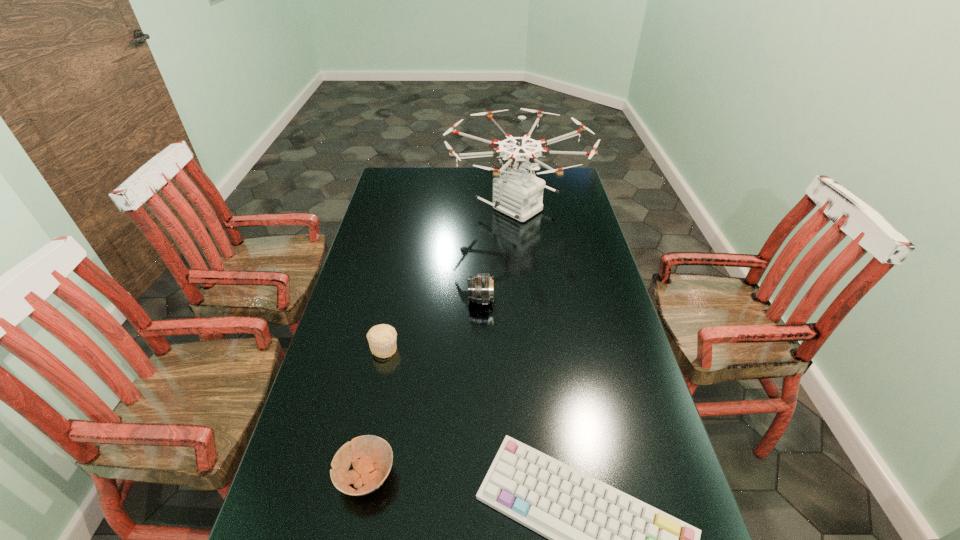
Locate an element on the screen. vacant space situated at the front element of the fourth nearest object is located at coordinates (344, 300).

The height and width of the screenshot is (540, 960). What are the coordinates of `vacant space situated 0.210m on the front of the third tallest object` in the screenshot? It's located at (368, 429).

Image resolution: width=960 pixels, height=540 pixels. Identify the location of vacant space situated 0.270m on the right of the bowl. (516, 476).

Identify the location of object situated at the far edge. (519, 194).

Where is `muffin situated at the left edge`? muffin situated at the left edge is located at coordinates (382, 338).

What are the coordinates of `bowl present at the left edge` in the screenshot? It's located at (371, 470).

The width and height of the screenshot is (960, 540). Find the location of `object at the right edge`. object at the right edge is located at coordinates (519, 194).

At what (x,y) coordinates should I click in order to perform the action: click on object located in the far right corner section of the desktop. Please return your answer as a coordinate pair (x, y). Looking at the image, I should click on (519, 194).

This screenshot has width=960, height=540. I want to click on free space at the far edge of the desktop, so [527, 169].

Find the location of a particular element. vacant area at the left edge of the desktop is located at coordinates (339, 409).